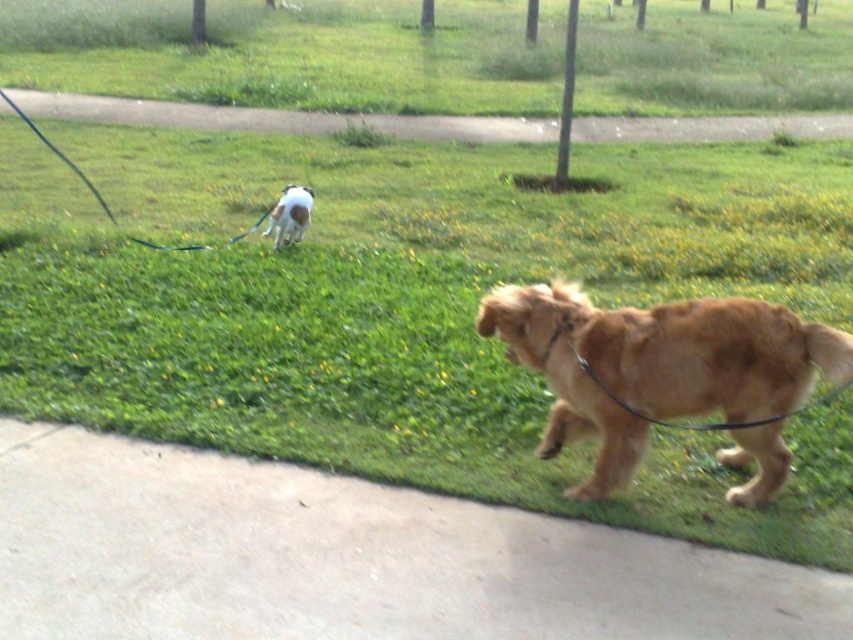
Between golden fur dog at center and white fur dog at center, which one has less height?

With less height is white fur dog at center.

The width and height of the screenshot is (853, 640). I want to click on golden fur dog at center, so click(x=654, y=364).

I want to click on golden fur dog at center, so click(654, 364).

Measure the distance from black rubber leash at upper left to white fur dog at center.

black rubber leash at upper left and white fur dog at center are 38.46 inches apart from each other.

Is point (4, 96) positioned in front of point (279, 198)?

No, it is behind (279, 198).

Find the location of a particular element. The image size is (853, 640). black rubber leash at upper left is located at coordinates (93, 186).

Find the location of a particular element. The width and height of the screenshot is (853, 640). black rubber leash at upper left is located at coordinates (93, 186).

Is golden fur dog at center thinner than black rubber leash at upper left?

Correct, golden fur dog at center's width is less than black rubber leash at upper left's.

Is point (836, 346) positioned before point (173, 248)?

Yes, point (836, 346) is closer to viewer.

You are a GUI agent. You are given a task and a screenshot of the screen. Output one action in this format:
    pyautogui.click(x=<x>, y=<y>)
    Task: Click on the golden fur dog at center
    This screenshot has width=853, height=640.
    Given the screenshot: What is the action you would take?
    pyautogui.click(x=654, y=364)